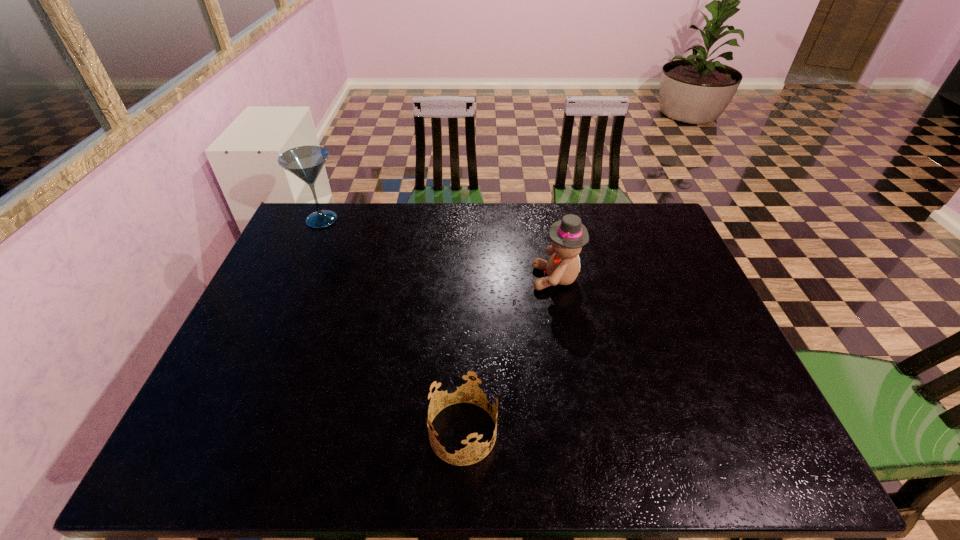
The width and height of the screenshot is (960, 540). Identify the location of the farthest object. (306, 162).

Image resolution: width=960 pixels, height=540 pixels. I want to click on martini, so click(x=306, y=162).

The image size is (960, 540). Identify the location of the second farthest object. (568, 236).

This screenshot has height=540, width=960. Identify the location of the rightmost object. (568, 236).

Locate an element on the screen. The image size is (960, 540). the second object from right to left is located at coordinates (461, 386).

Where is `the nearest object`? The height and width of the screenshot is (540, 960). the nearest object is located at coordinates (461, 386).

Where is `vacant space located on the front of the farthest object`? The height and width of the screenshot is (540, 960). vacant space located on the front of the farthest object is located at coordinates (307, 253).

The width and height of the screenshot is (960, 540). In order to click on free space located on the front-facing side of the second nearest object in this screenshot , I will do `click(444, 278)`.

At what (x,y) coordinates should I click in order to perform the action: click on free space located on the front-facing side of the second nearest object. Please return your answer as a coordinate pair (x, y). Image resolution: width=960 pixels, height=540 pixels. Looking at the image, I should click on (417, 278).

I want to click on free region located on the front-facing side of the second nearest object, so click(447, 278).